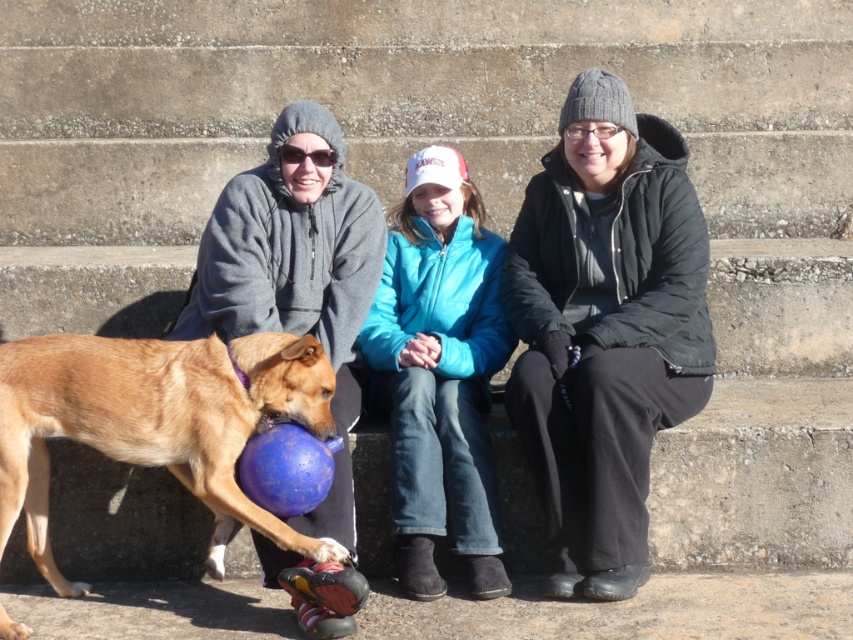
Is black fuzzy jacket at center thinner than blue fleece jacket at center?

Incorrect, black fuzzy jacket at center's width is not less than blue fleece jacket at center's.

Does black fuzzy jacket at center appear on the right side of blue fleece jacket at center?

Indeed, black fuzzy jacket at center is positioned on the right side of blue fleece jacket at center.

Between point (666, 307) and point (439, 500), which one is positioned behind?

Positioned behind is point (666, 307).

Locate an element on the screen. The width and height of the screenshot is (853, 640). black fuzzy jacket at center is located at coordinates (605, 328).

Which is more to the right, matte gray hoodie at center or brown fur dog at center?

matte gray hoodie at center

Is point (517, 220) more distant than point (312, 390)?

Yes.

Does point (637, 509) lie behind point (161, 438)?

Yes, it is.

At what (x,y) coordinates should I click in order to perform the action: click on matte gray hoodie at center. Please return your answer as a coordinate pair (x, y). Looking at the image, I should click on (605, 328).

Who is lower down, matte gray hoodie at center or gray fleece jacket at left?

gray fleece jacket at left is lower down.

Who is more forward, (679,156) or (265,544)?

Point (265,544)

Identify the location of matte gray hoodie at center. The image size is (853, 640). (605, 328).